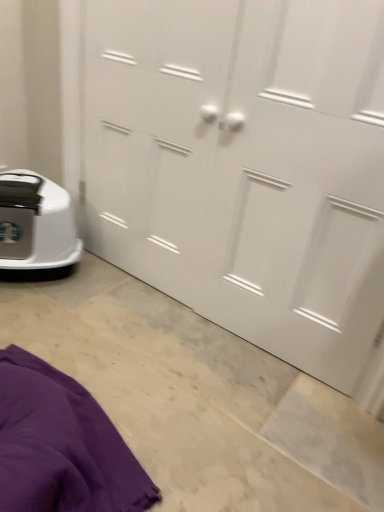
Question: From a real-world perspective, relative to purple fabric at lower left, is white plastic robot vacuum at lower left vertically above or below?

Choices:
 (A) below
 (B) above

Answer: (B)

Question: Is white plastic robot vacuum at lower left taller or shorter than purple fabric at lower left?

Choices:
 (A) tall
 (B) short

Answer: (A)

Question: Which object is the farthest from the white plastic robot vacuum at lower left?

Choices:
 (A) purple fabric at lower left
 (B) white matte door at center

Answer: (A)

Question: Based on their relative distances, which object is nearer to the white matte door at center?

Choices:
 (A) purple fabric at lower left
 (B) white plastic robot vacuum at lower left

Answer: (B)